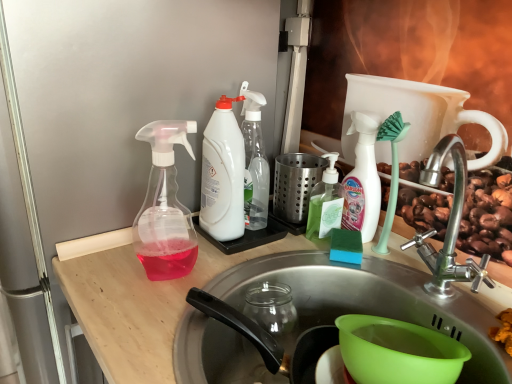
At what (x,y) coordinates should I click in order to perform the action: click on vacant space in front of white plastic spray bottle at center, which is the 3th bottle from left to right. Please return your answer as a coordinate pair (x, y). This screenshot has height=384, width=512. Looking at the image, I should click on (256, 256).